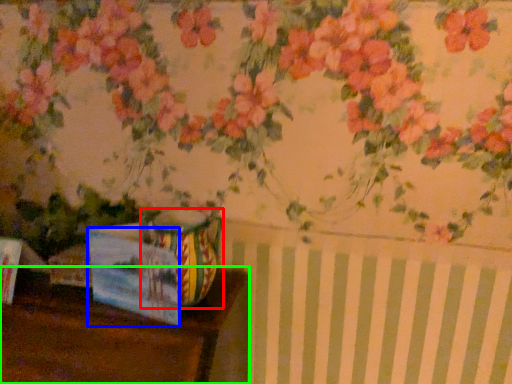
Question: Which is nearer to the vase (highlighted by a red box)? postcard (highlighted by a blue box) or table (highlighted by a green box).

Choices:
 (A) postcard
 (B) table

Answer: (A)